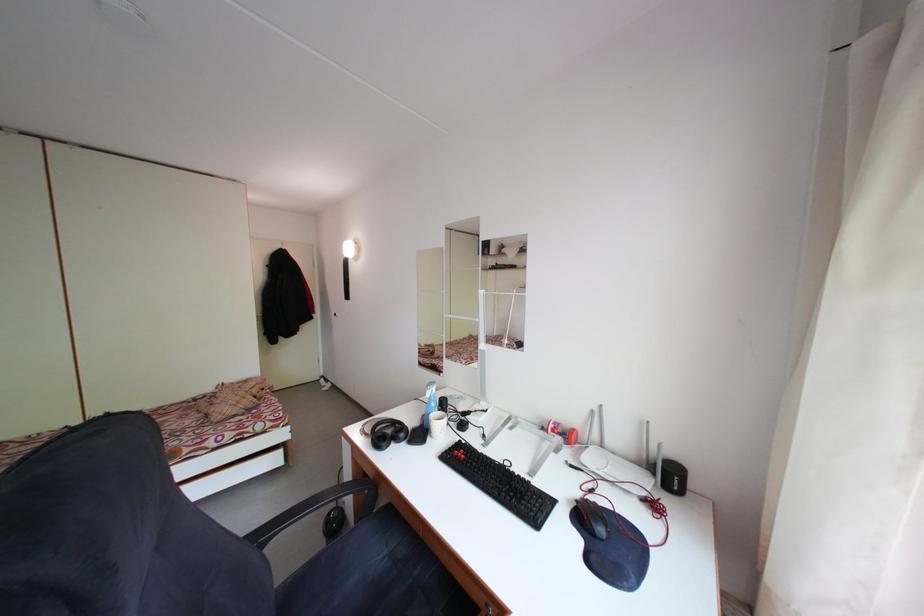
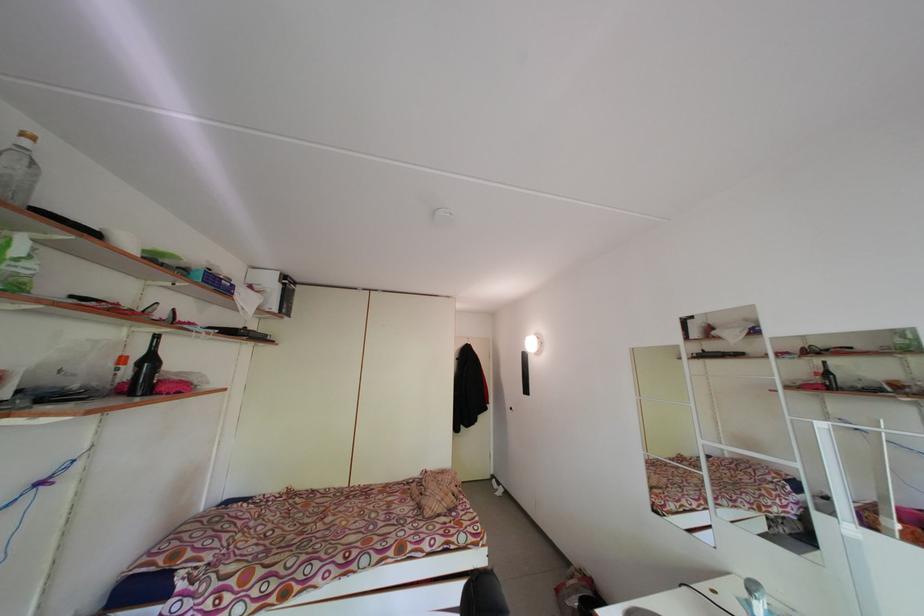
How did the camera likely rotate?

The camera's rotation is toward left-up.